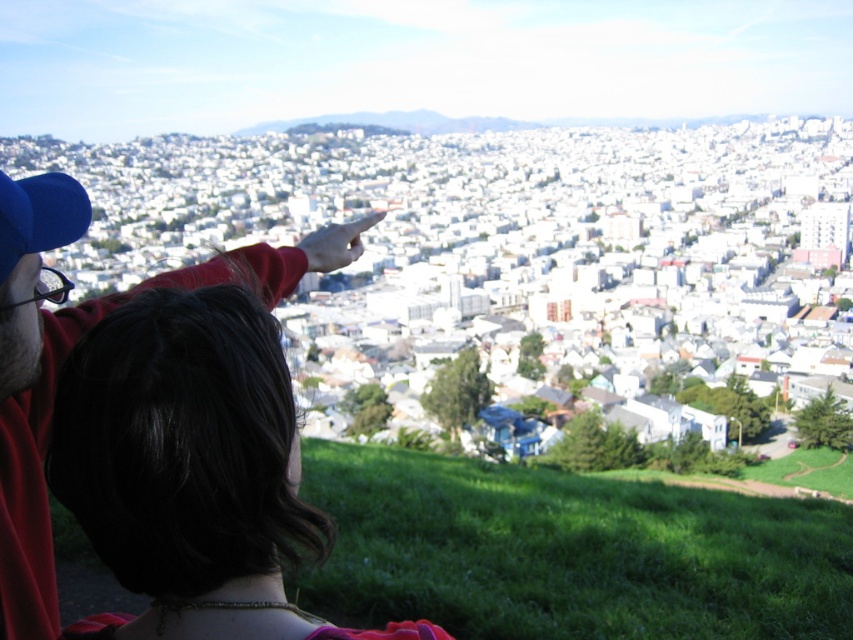
Between blue fabric cap at upper left and blue fabric baseball cap at upper left, which one is positioned lower?

blue fabric cap at upper left

Between point (38, 180) and point (39, 250), which one is positioned behind?

The point (38, 180) is more distant.

In the scene shown: Who is more forward, [76,205] or [88,204]?

Point [88,204]

Where is `blue fabric cap at upper left`? blue fabric cap at upper left is located at coordinates (68, 349).